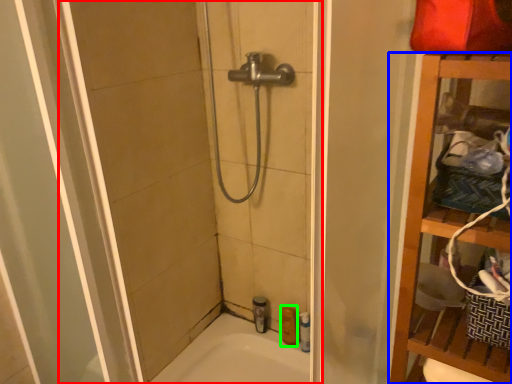
Question: Estimate the real-world distances between objects in this image. Which object is closer to shower door (highlighted by a red box), furniture (highlighted by a blue box) or toiletry (highlighted by a green box)?

Choices:
 (A) furniture
 (B) toiletry

Answer: (B)